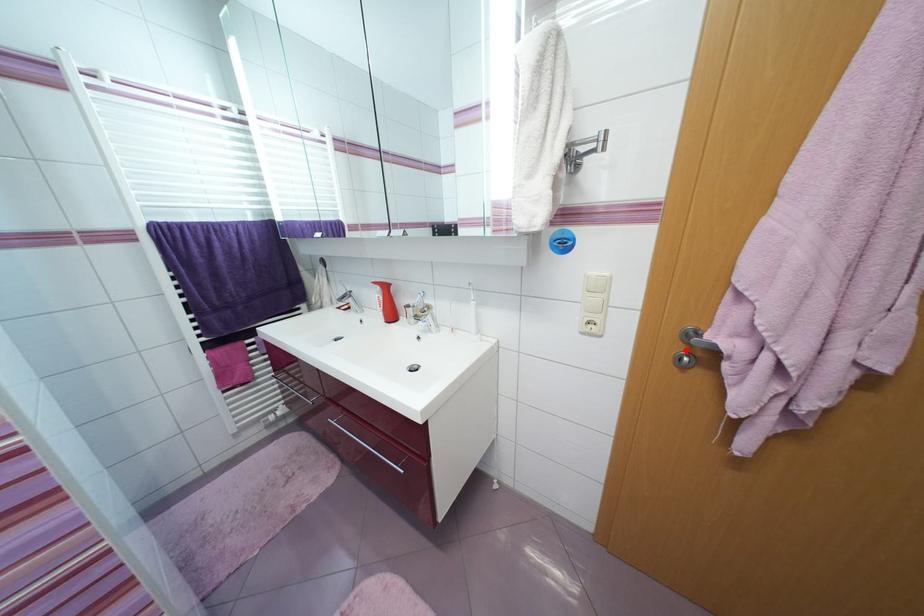
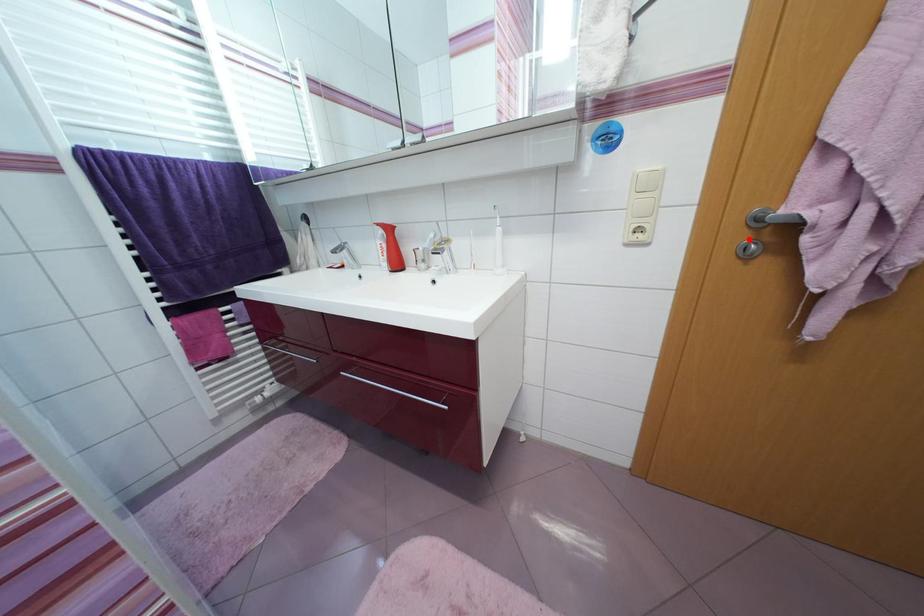
I am providing you with two images of the same scene from different viewpoints. A red point is marked on the first image and another point is marked on the second image. Do the highlighted points in image1 and image2 indicate the same real-world spot?

Yes